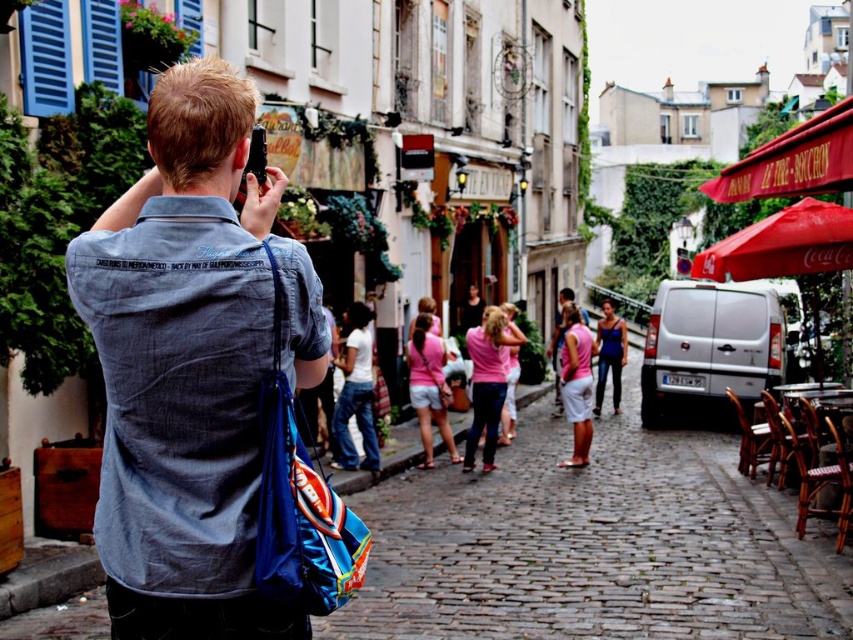
You are a fashion designer observing the scene. You notice the denim jacket at upper left and the pink fabric dress at center. Which clothing item is positioned higher in the image?

The denim jacket at upper left is positioned higher in the image than the pink fabric dress at center.

You are a tourist in Paris and you want to take a photo of the denim jacket at upper left. Where should you position yourself to capture it in the frame?

The denim jacket at upper left is located at point (190, 364), so you should position yourself in the upper left area to capture it in the frame.

You are standing at the camera position in the scene. There is a denim jacket at upper left that you want to pick up. Can you reach it without moving from your current position?

The denim jacket at upper left is 20.07 meters away from the camera, so you cannot reach it without moving from your current position.